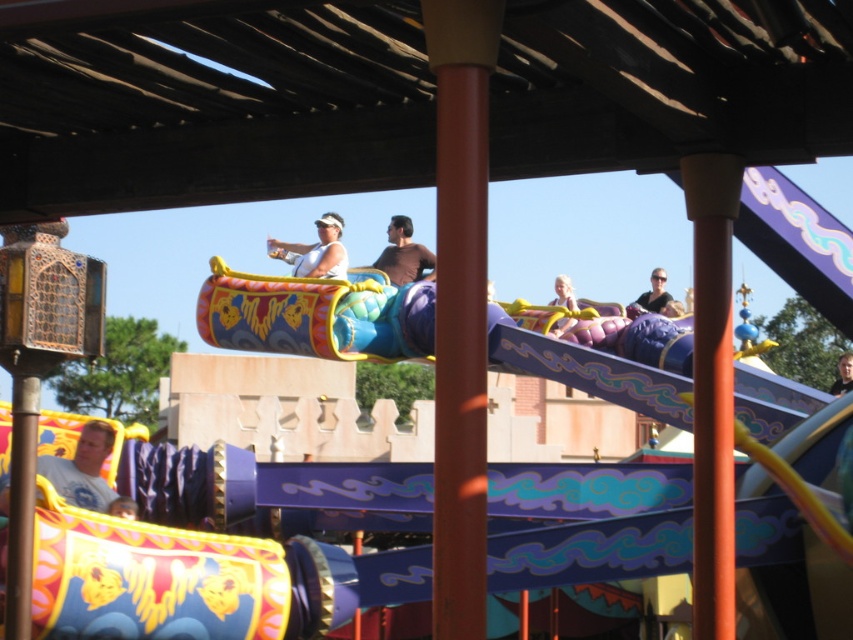
Please look at the image and locate the point at coordinates (650, 296). What object is positioned exactly at that point?

The matte black sunglasses at upper center is positioned exactly at point (650, 296).

Consider the image. You are a photographer standing in the theme park and you want to take a photo of the white cotton shirt at lower left and smooth brown hair at upper center. Which object is closer to the bottom of the photo?

The white cotton shirt at lower left is closer to the bottom of the photo because it is positioned below the smooth brown hair at upper center.

You are a photographer at the theme park and want to take a photo of the brown matte shirt at center and smooth brown hair at upper center. To ensure both are in the frame, where should you position the camera relative to the subjects?

The brown matte shirt at center is to the left of the smooth brown hair at upper center, so the camera should be positioned to the right of both subjects to capture both in the frame.